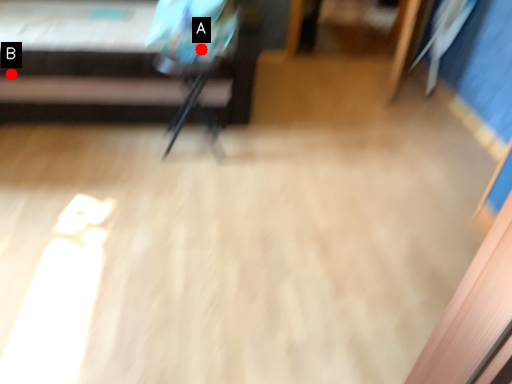
Question: Two points are circled on the image, labeled by A and B beside each circle. Which point is further to the camera?

Choices:
 (A) A is further
 (B) B is further

Answer: (B)